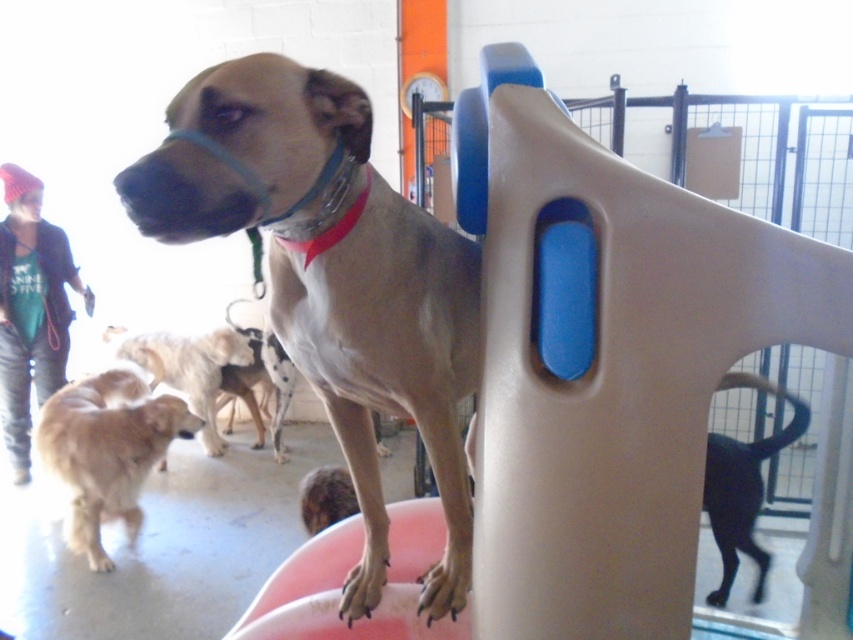
Question: Can you confirm if light brown fur at center is positioned above golden fur dog at lower left?

Choices:
 (A) no
 (B) yes

Answer: (B)

Question: Is black glossy dog at lower right to the right of golden fur dog at lower left from the viewer's perspective?

Choices:
 (A) no
 (B) yes

Answer: (B)

Question: Which of the following is the farthest from the observer?

Choices:
 (A) (51, 397)
 (B) (126, 168)
 (C) (749, 451)
 (D) (103, 339)

Answer: (D)

Question: Is light brown fur at center bigger than golden fur dog at center?

Choices:
 (A) yes
 (B) no

Answer: (B)

Question: Which point is closer to the camera?

Choices:
 (A) golden fur dog at center
 (B) black glossy dog at lower right

Answer: (B)

Question: Which of the following is the closest to the observer?

Choices:
 (A) click(x=769, y=394)
 (B) click(x=151, y=346)
 (C) click(x=222, y=218)
 (D) click(x=76, y=417)

Answer: (C)